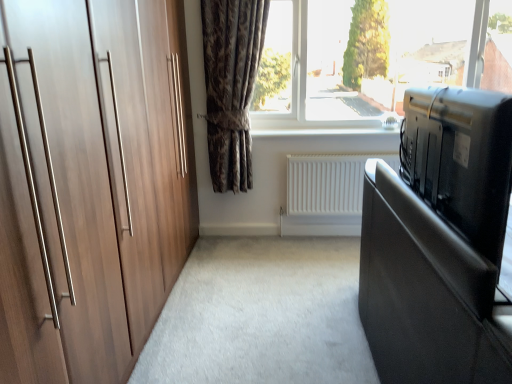
Question: From their relative heights in the image, would you say smooth black bed at right is taller or shorter than white matte radiator at center?

Choices:
 (A) short
 (B) tall

Answer: (A)

Question: In terms of size, does smooth black bed at right appear bigger or smaller than white matte radiator at center?

Choices:
 (A) big
 (B) small

Answer: (A)

Question: Which object is the farthest from the smooth black bed at right?

Choices:
 (A) black glossy tv at right
 (B) transparent glass window at upper center
 (C) dark brown textured curtain at center
 (D) black plastic television at right
 (E) white matte radiator at center

Answer: (B)

Question: Based on their relative distances, which object is farther from the black plastic television at right?

Choices:
 (A) transparent glass window at upper center
 (B) white matte radiator at center
 (C) dark brown textured curtain at center
 (D) smooth black bed at right
 (E) black glossy tv at right

Answer: (A)